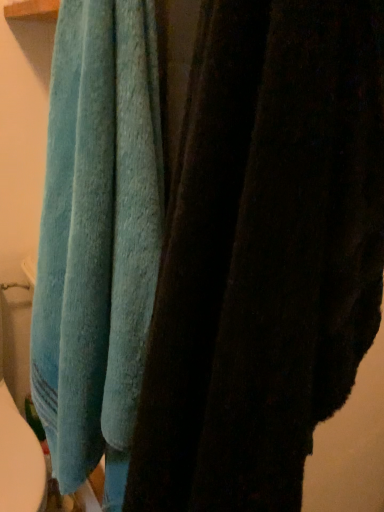
Question: In terms of width, does teal soft towel at left, which is counted as the second towel, starting from the right, look wider or thinner when compared to blue soft towel at upper left, the second towel positioned from the left?

Choices:
 (A) thin
 (B) wide

Answer: (A)

Question: Visually, is teal soft towel at left, placed as the 1th towel when sorted from left to right, positioned to the left or to the right of blue soft towel at upper left, the 1th towel from the right?

Choices:
 (A) left
 (B) right

Answer: (A)

Question: From the image's perspective, is teal soft towel at left, placed as the 1th towel when sorted from left to right, located above or below blue soft towel at upper left, the 1th towel from the right?

Choices:
 (A) above
 (B) below

Answer: (A)

Question: In the image, is blue soft towel at upper left, the second towel positioned from the left, positioned in front of or behind teal soft towel at left, placed as the 1th towel when sorted from left to right?

Choices:
 (A) behind
 (B) front

Answer: (B)

Question: Which is correct: blue soft towel at upper left, the second towel positioned from the left, is inside teal soft towel at left, placed as the 1th towel when sorted from left to right, or outside of it?

Choices:
 (A) outside
 (B) inside

Answer: (A)

Question: From the image's perspective, relative to teal soft towel at left, which is counted as the second towel, starting from the right, is blue soft towel at upper left, the 1th towel from the right, above or below?

Choices:
 (A) below
 (B) above

Answer: (A)

Question: From their relative heights in the image, would you say blue soft towel at upper left, the 1th towel from the right, is taller or shorter than teal soft towel at left, placed as the 1th towel when sorted from left to right?

Choices:
 (A) tall
 (B) short

Answer: (B)